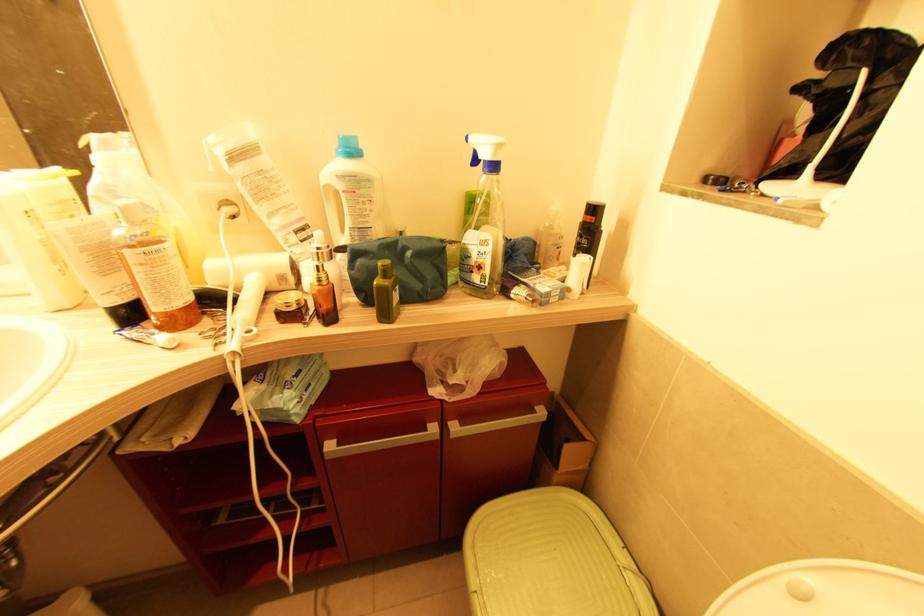
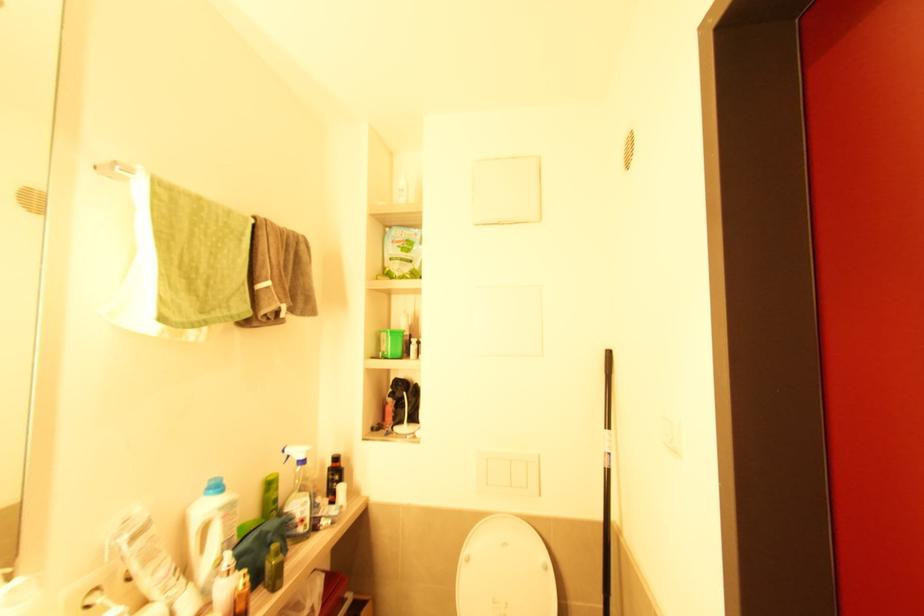
The point at [494,168] is marked in the first image. Where is the corresponding point in the second image?

(305, 462)